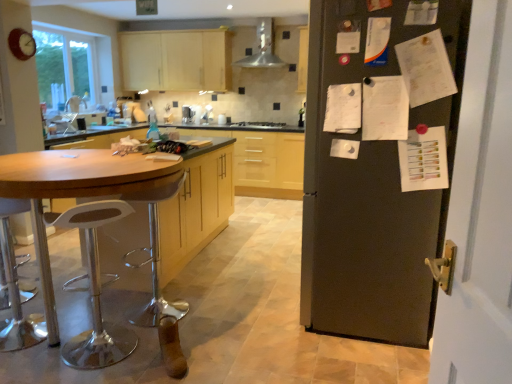
Where is `vacant area that lies between matte black refrigerator at right and metallic silver bar stool at left, placed as the 1th bar stool when sorted from back to front`? This screenshot has height=384, width=512. vacant area that lies between matte black refrigerator at right and metallic silver bar stool at left, placed as the 1th bar stool when sorted from back to front is located at coordinates (248, 310).